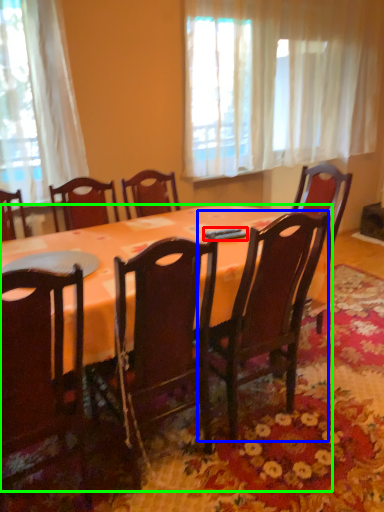
Question: Which is nearer to the remote control (highlighted by a red box)? chair (highlighted by a blue box) or kitchen & dining room table (highlighted by a green box).

Choices:
 (A) chair
 (B) kitchen & dining room table

Answer: (A)